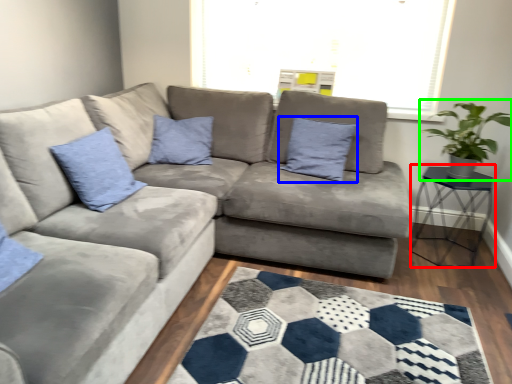
Question: Estimate the real-world distances between objects in this image. Which object is farther from table (highlighted by a red box), pillow (highlighted by a blue box) or houseplant (highlighted by a green box)?

Choices:
 (A) pillow
 (B) houseplant

Answer: (A)